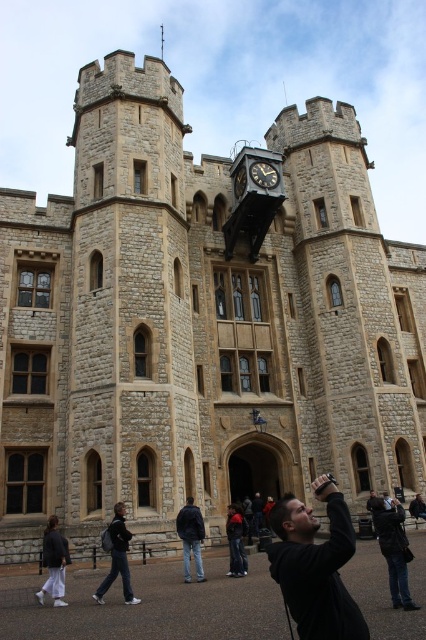
Question: Which point is closer to the camera?

Choices:
 (A) (287, 540)
 (B) (63, 557)

Answer: (A)

Question: Can you confirm if white cotton pants at lower left is smaller than dark brown wooden clock at center?

Choices:
 (A) yes
 (B) no

Answer: (B)

Question: Which point is closer to the camera taking this photo?

Choices:
 (A) (388, 577)
 (B) (187, 552)

Answer: (A)

Question: Is black matte jacket at lower right wider than jeans at center?

Choices:
 (A) yes
 (B) no

Answer: (A)

Question: Which point is farther from the camera taking this photo?

Choices:
 (A) (195, 524)
 (B) (293, 616)

Answer: (A)

Question: Does black matte jacket at lower right have a smaller size compared to black metal clock at upper center?

Choices:
 (A) no
 (B) yes

Answer: (A)